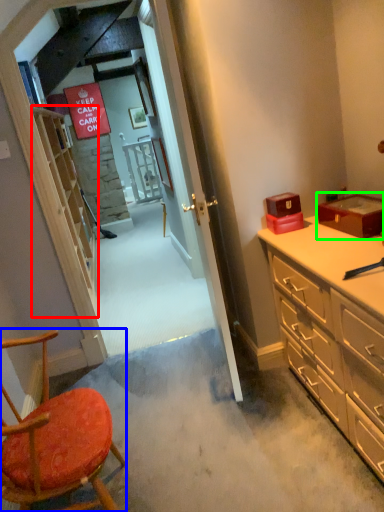
Question: Estimate the real-world distances between objects in this image. Which object is closer to shelf (highlighted by a red box), chair (highlighted by a blue box) or box (highlighted by a green box)?

Choices:
 (A) chair
 (B) box

Answer: (A)